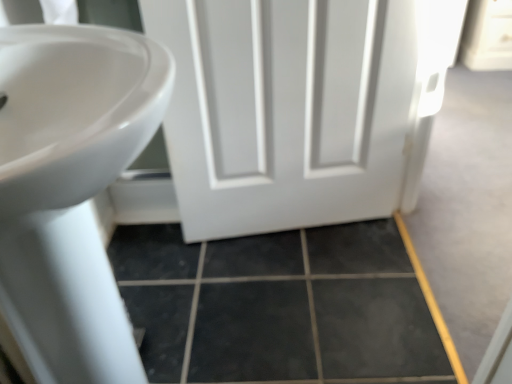
This screenshot has height=384, width=512. Identify the location of free spot above dark gray tile at lower center (from a real-world perspective). (287, 279).